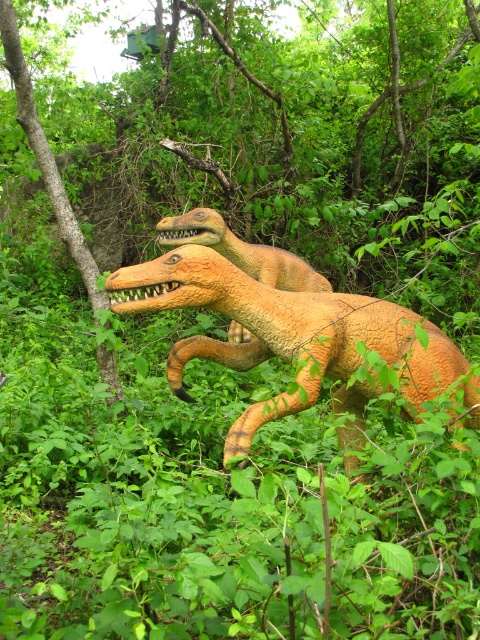
Question: Which point appears closest to the camera in this image?

Choices:
 (A) (346, 388)
 (B) (184, 237)

Answer: (A)

Question: Does orange textured dinosaur at center have a smaller size compared to orange matte dinosaur at center?

Choices:
 (A) no
 (B) yes

Answer: (A)

Question: Which object appears closest to the camera in this image?

Choices:
 (A) orange textured dinosaur at center
 (B) orange matte dinosaur at center

Answer: (A)

Question: Is orange textured dinosaur at center to the right of orange matte dinosaur at center from the viewer's perspective?

Choices:
 (A) no
 (B) yes

Answer: (B)

Question: In this image, where is orange textured dinosaur at center located relative to orange matte dinosaur at center?

Choices:
 (A) below
 (B) above

Answer: (A)